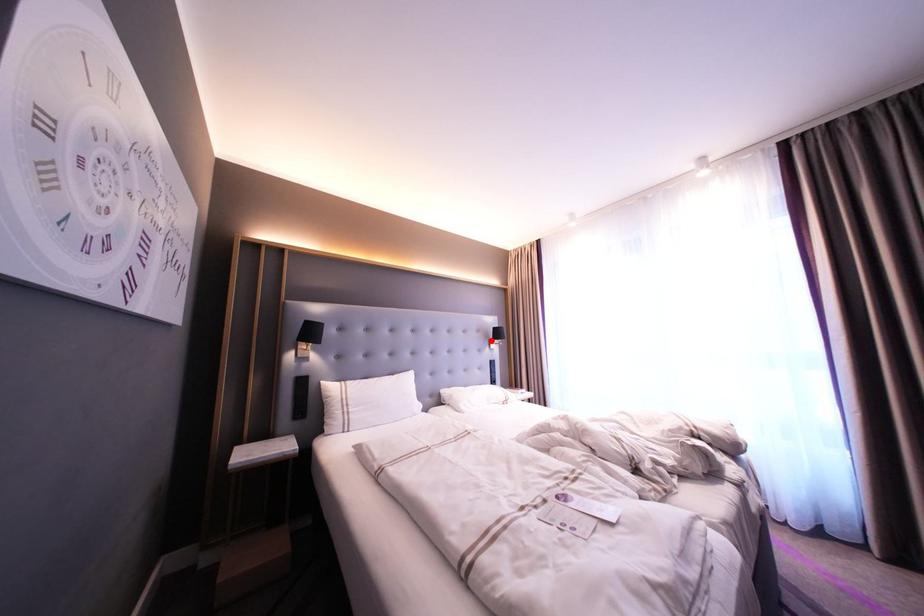
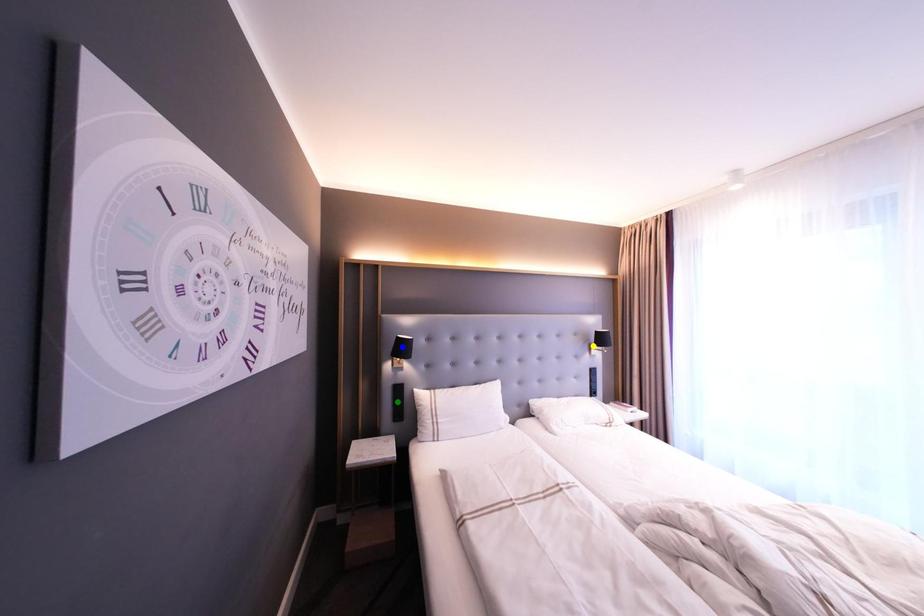
Question: I am providing you with two images of the same scene from different viewpoints. A red point is marked on the first image. You are given multiple points on the second image. Which spot in image 2 lines up with the point in image 1?

Choices:
 (A) green point
 (B) blue point
 (C) yellow point

Answer: (C)